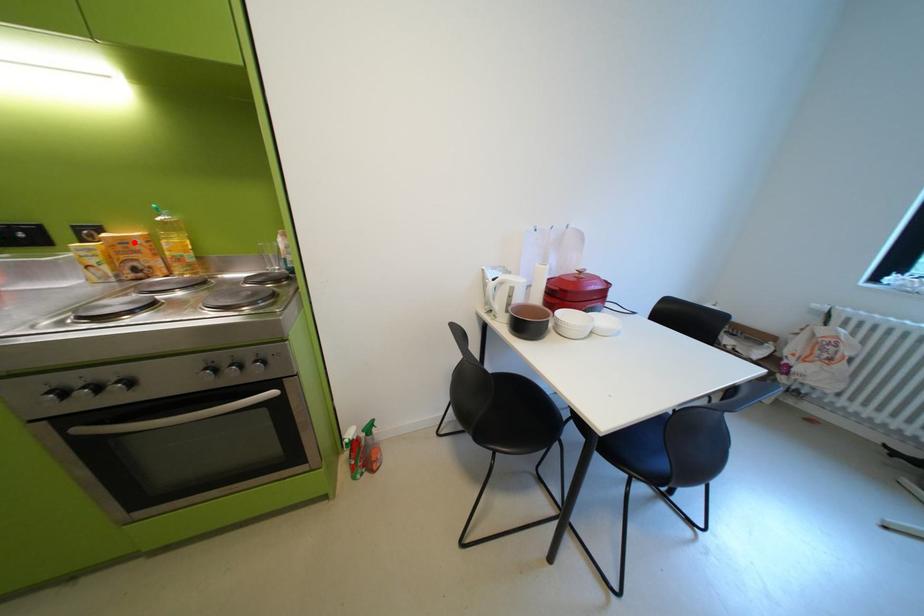
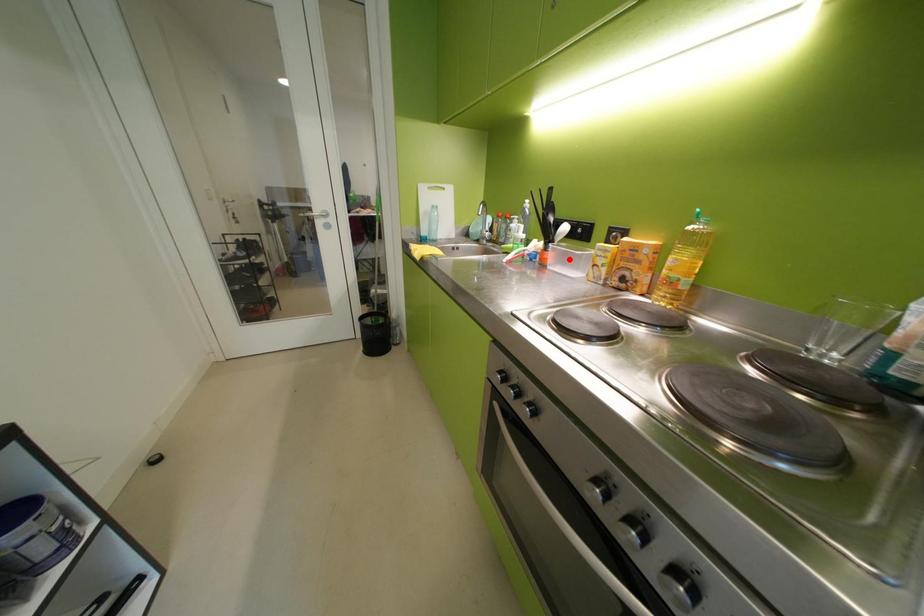
I am providing you with two images of the same scene from different viewpoints. A red point is marked on the first image and another point is marked on the second image. Does the point marked in image1 correspond to the same location as the one in image2?

No